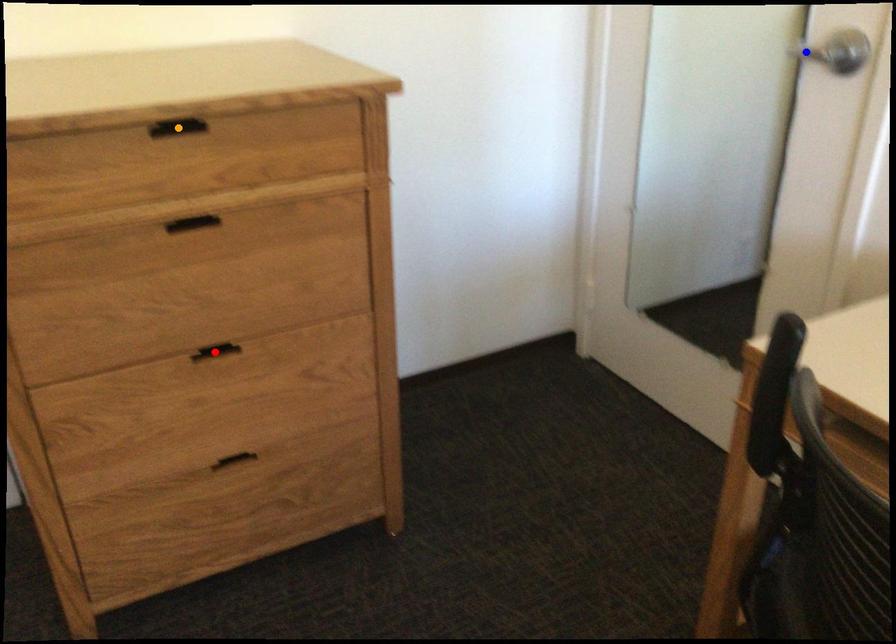
Order these from nearest to farthest:
- blue point
- orange point
- red point

orange point → red point → blue point